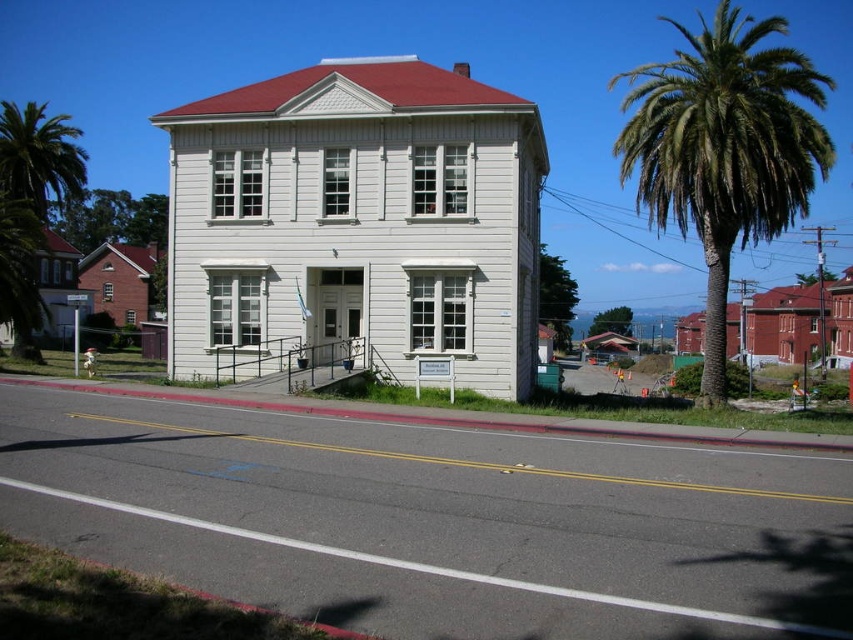
Does green leafy palm tree at right appear over green leafy palm tree at left?

Indeed, green leafy palm tree at right is positioned over green leafy palm tree at left.

Between green leafy palm tree at right and green leafy palm tree at left, which one is positioned higher?

green leafy palm tree at right is above.

Who is more distant from viewer, (715, 172) or (9, 228)?

Positioned behind is point (9, 228).

Where is `green leafy palm tree at right`? green leafy palm tree at right is located at coordinates (724, 148).